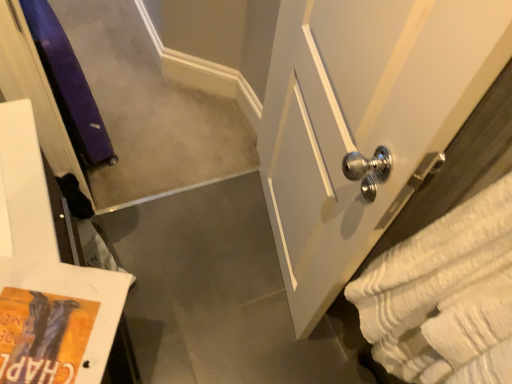
What do you see at coordinates (364, 124) in the screenshot? I see `white glossy door at right` at bounding box center [364, 124].

What is the approximate width of white glossy door at right?

6.25 inches.

Find the location of a particular element. The image size is (512, 384). white glossy door at right is located at coordinates (364, 124).

The width and height of the screenshot is (512, 384). Identify the location of white textured bath towel at right. (445, 296).

Describe the element at coordinates (445, 296) in the screenshot. The image size is (512, 384). I see `white textured bath towel at right` at that location.

You are a GUI agent. You are given a task and a screenshot of the screen. Output one action in this format:
    pyautogui.click(x=<x>, y=<y>)
    Task: Click on the white glossy door at right
    The width and height of the screenshot is (512, 384).
    Given the screenshot: What is the action you would take?
    click(364, 124)

Is white textured bath towel at right to the right of white glossy door at right from the viewer's perspective?

Yes, white textured bath towel at right is to the right of white glossy door at right.

Considering their positions, is white textured bath towel at right located in front of or behind white glossy door at right?

In the image, white textured bath towel at right appears in front of white glossy door at right.

Considering the positions of point (473, 248) and point (298, 302), is point (473, 248) closer or farther from the camera than point (298, 302)?

Point (473, 248) is closer to the camera than point (298, 302).

From the image's perspective, which object appears higher, white textured bath towel at right or white glossy door at right?

white glossy door at right, from the image's perspective.

From a real-world perspective, between white textured bath towel at right and white glossy door at right, who is vertically lower?

From a 3D spatial view, white glossy door at right is below.

In terms of width, does white textured bath towel at right look wider or thinner when compared to white glossy door at right?

Considering their sizes, white textured bath towel at right looks broader than white glossy door at right.

Considering the relative sizes of white textured bath towel at right and white glossy door at right in the image provided, is white textured bath towel at right taller than white glossy door at right?

In fact, white textured bath towel at right may be shorter than white glossy door at right.

Between white textured bath towel at right and white glossy door at right, which one has larger size?

Bigger between the two is white glossy door at right.

Which is correct: white textured bath towel at right is inside white glossy door at right, or outside of it?

white textured bath towel at right is not enclosed by white glossy door at right.

Does white textured bath towel at right touch white glossy door at right?

white textured bath towel at right is not next to white glossy door at right, and they're not touching.

Is white textured bath towel at right oriented away from white glossy door at right?

white textured bath towel at right is not turned away from white glossy door at right.

Image resolution: width=512 pixels, height=384 pixels. In the image, there is a white glossy door at right. What are the coordinates of `bath towel below it (from the image's perspective)` in the screenshot? It's located at (445, 296).

Is white glossy door at right at the right side of white textured bath towel at right?

No.

Does white glossy door at right come behind white textured bath towel at right?

Yes, white glossy door at right is behind white textured bath towel at right.

Considering the points (377, 88) and (505, 207), which point is in front, point (377, 88) or point (505, 207)?

Positioned in front is point (505, 207).

From the image's perspective, is white glossy door at right under white textured bath towel at right?

No.

From a real-world perspective, is white glossy door at right positioned above or below white textured bath towel at right?

white glossy door at right is situated lower than white textured bath towel at right in the real world.

Is white glossy door at right wider than white textured bath towel at right?

No.

Between white glossy door at right and white textured bath towel at right, which one has more height?

white glossy door at right.

Which of these two, white glossy door at right or white textured bath towel at right, is smaller?

white textured bath towel at right is smaller.

Is white glossy door at right completely or partially outside of white textured bath towel at right?

Yes, white glossy door at right is not within white textured bath towel at right.

Would you consider white glossy door at right to be distant from white textured bath towel at right?

No.

Could you tell me if white glossy door at right is turned towards white textured bath towel at right?

No, white glossy door at right is not aimed at white textured bath towel at right.

How many degrees apart are the facing directions of white glossy door at right and white textured bath towel at right?

The angular difference between white glossy door at right and white textured bath towel at right is 11.7 degrees.

You are a GUI agent. You are given a task and a screenshot of the screen. Output one action in this format:
    pyautogui.click(x=<x>, y=<y>)
    Task: Click on the bath towel that is in front of the white glossy door at right
    This screenshot has height=384, width=512.
    Given the screenshot: What is the action you would take?
    pyautogui.click(x=445, y=296)

The image size is (512, 384). Find the location of `bath towel below the white glossy door at right (from the image's perspective)`. bath towel below the white glossy door at right (from the image's perspective) is located at coordinates (445, 296).

The height and width of the screenshot is (384, 512). Identify the location of bath towel lying on the right of white glossy door at right. (445, 296).